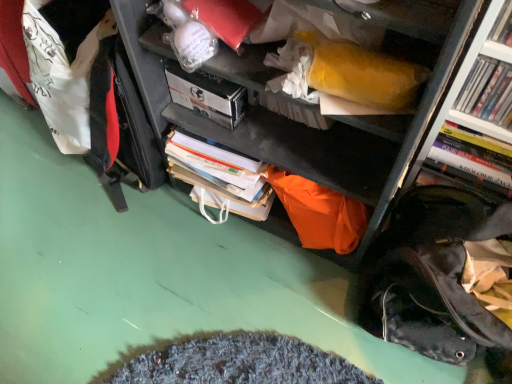
Image resolution: width=512 pixels, height=384 pixels. I want to click on vacant space in front of white matte paperback book at upper center, so click(220, 151).